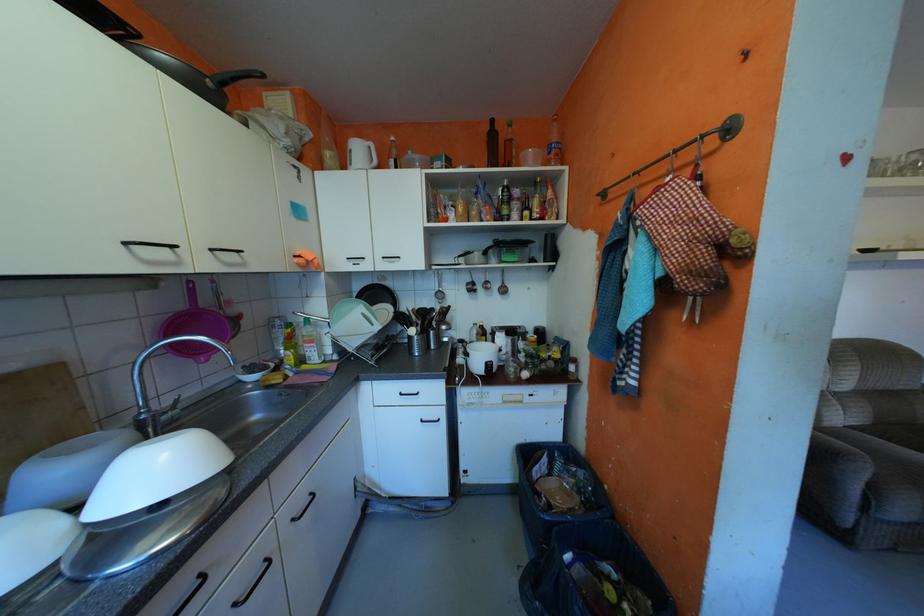
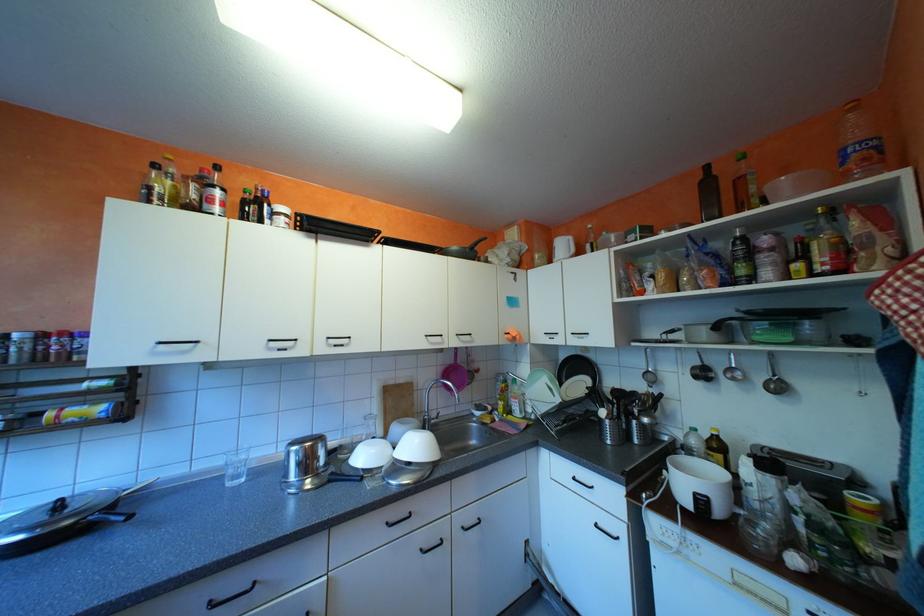
Find the pixel in the second image that matches point 497,362 in the first image.

(708, 493)